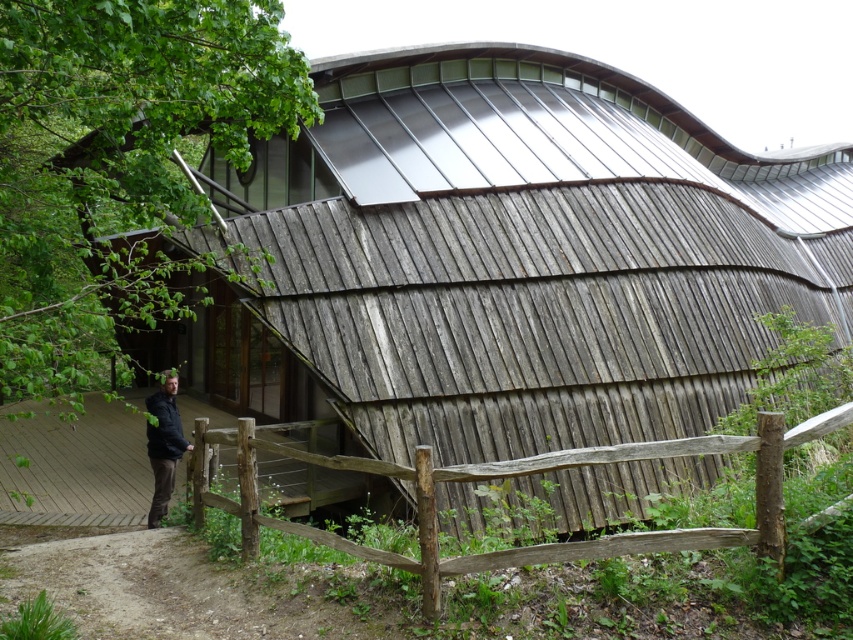
You are standing on the deck and want to take a photo of the building. The weathered wood fence at lower center and the dark gray hoodie at center are in your way. Which object should you move to get a clear view?

You should move the weathered wood fence at lower center because it is positioned under the dark gray hoodie at center, so moving the fence would allow you to see the building without obstruction.

You are standing on the deck in front of the building and want to walk towards the weathered wood fence at lower center. Is the dark gray hoodie at center in your path?

The weathered wood fence at lower center is closer to the viewer than the dark gray hoodie at center, so the dark gray hoodie at center is behind the fence and not in your path.